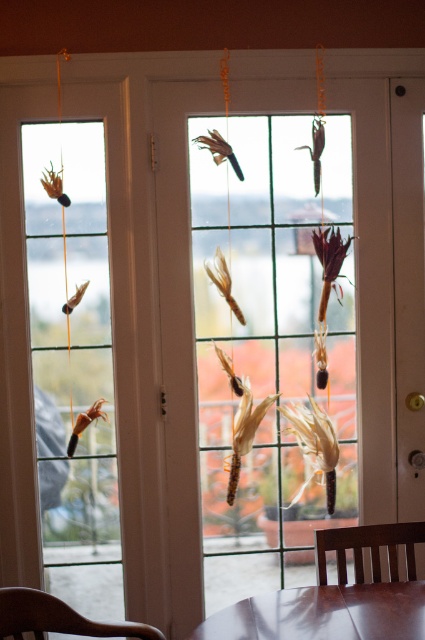
You are a guest entering the room and need to sit down. You see the glossy brown table at lower center and the brown wood chair at lower left. Which object should you approach to find a seat?

The brown wood chair at lower left is taller than the glossy brown table at lower center, so you should approach the brown wood chair at lower left to find a seat.

You are standing in the room and want to move towards the French doors with a grid pattern. Is the brown wood chair at lower left blocking your path to the doors?

The brown wood chair at lower left is located at point (57, 618), which is near the lower left corner of the room. Since the French doors are framed by the white door frames with grid pattern glass panes, the chair is positioned away from the doors and likely not blocking the path.

You are standing in the room and want to sit down. Which object at point (57, 618) is available for you to sit on?

The brown wood chair at lower left is available at point (57, 618) for you to sit on.